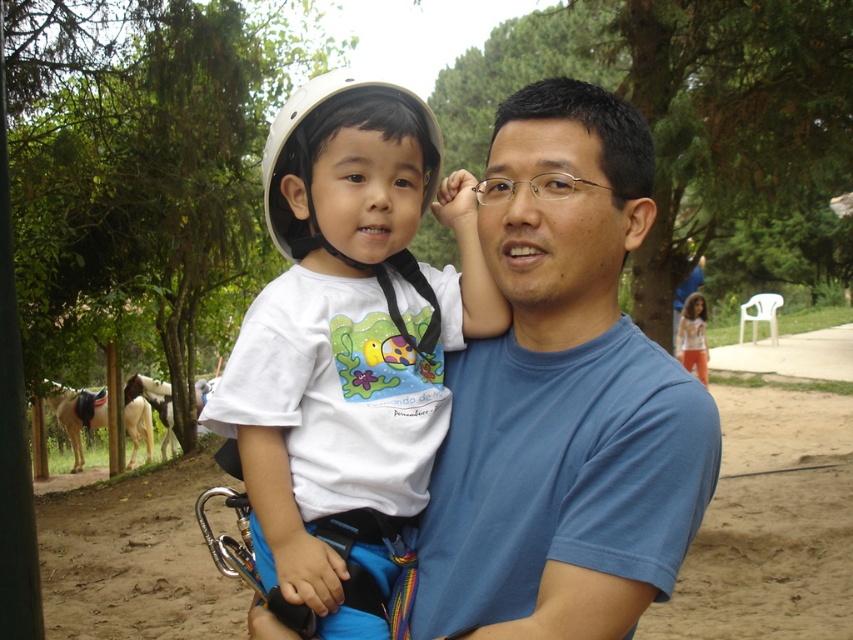
Question: Which object appears closest to the camera in this image?

Choices:
 (A) white matte helmet at upper center
 (B) white cotton shirt at center
 (C) blue cotton shirt at center
 (D) white matte helmet at upper left

Answer: (C)

Question: Is blue cotton shirt at center in front of white matte helmet at upper center?

Choices:
 (A) yes
 (B) no

Answer: (A)

Question: Based on their relative distances, which object is nearer to the white matte helmet at upper left?

Choices:
 (A) white cotton shirt at center
 (B) white matte helmet at upper center

Answer: (B)

Question: Is white matte helmet at upper left positioned before white cotton shirt at center?

Choices:
 (A) no
 (B) yes

Answer: (B)

Question: Is blue cotton shirt at center closer to camera compared to white cotton shirt at center?

Choices:
 (A) no
 (B) yes

Answer: (B)

Question: Which point is farther from the camera taking this photo?

Choices:
 (A) (289, 216)
 (B) (643, 225)

Answer: (A)